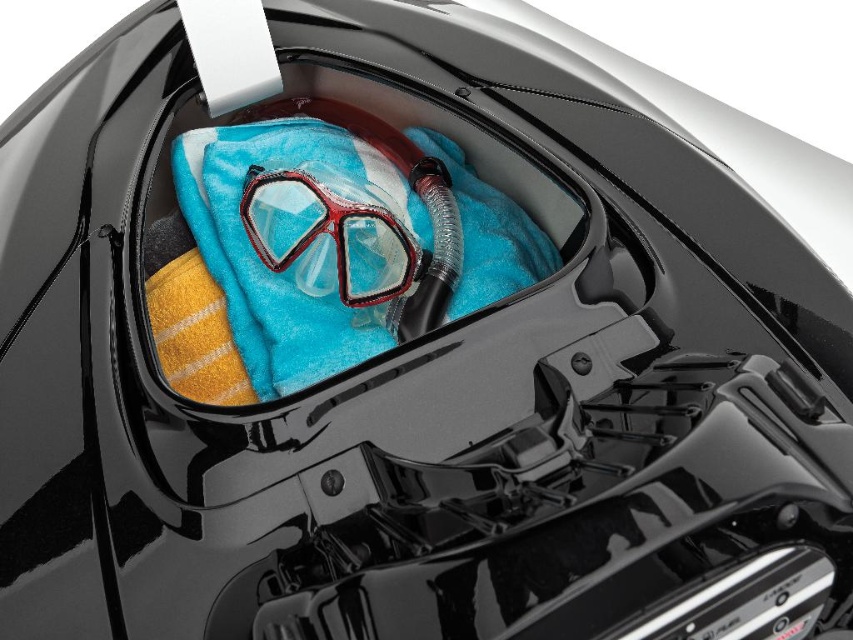
Can you confirm if blue towel at center is smaller than clear plastic goggles at center?

No.

Who is more forward, (312, 228) or (281, 259)?

Point (312, 228)

The height and width of the screenshot is (640, 853). I want to click on blue towel at center, so click(x=343, y=243).